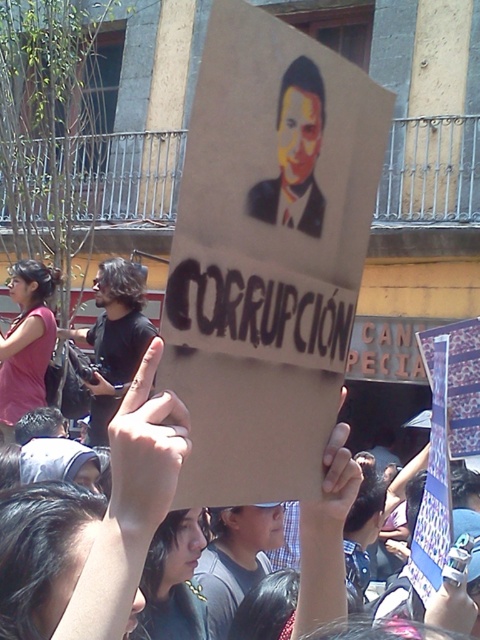
Question: Is yellow painted face at center further to the viewer compared to matte pink shirt at left?

Choices:
 (A) no
 (B) yes

Answer: (A)

Question: Is black t-shirt at center closer to camera compared to matte pink shirt at left?

Choices:
 (A) no
 (B) yes

Answer: (A)

Question: Which point is closer to the camera?

Choices:
 (A) (22, 296)
 (B) (104, 285)
 (C) (292, 224)

Answer: (C)

Question: Is black t-shirt at center bigger than matte pink shirt at left?

Choices:
 (A) no
 (B) yes

Answer: (B)

Question: Based on their relative distances, which object is nearer to the yellow painted face at center?

Choices:
 (A) matte pink shirt at left
 (B) black t-shirt at center

Answer: (A)

Question: Which of the following is the closest to the observer?

Choices:
 (A) (289, 160)
 (B) (46, 353)

Answer: (A)